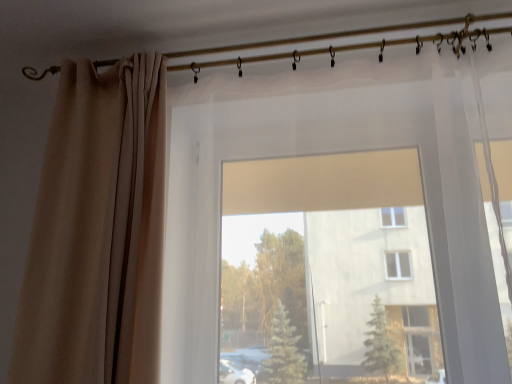
What are the coordinates of `beige fabric curtain at left` in the screenshot? It's located at (97, 232).

Describe the element at coordinates (97, 232) in the screenshot. I see `beige fabric curtain at left` at that location.

In order to face metallic curtain rod at upper center, should I rotate leftwards or rightwards?

Rotate your view left by about 0.844°.

The image size is (512, 384). I want to click on metallic curtain rod at upper center, so [x=350, y=35].

What do you see at coordinates (350, 35) in the screenshot?
I see `metallic curtain rod at upper center` at bounding box center [350, 35].

The width and height of the screenshot is (512, 384). What are the coordinates of `beige fabric curtain at left` in the screenshot? It's located at (97, 232).

Consider the image. Between beige fabric curtain at left and metallic curtain rod at upper center, which one appears on the left side from the viewer's perspective?

Positioned to the left is beige fabric curtain at left.

In the scene shown: Does beige fabric curtain at left come behind metallic curtain rod at upper center?

No, it is not.

Is point (56, 310) closer or farther from the camera than point (364, 46)?

Clearly, point (56, 310) is closer to the camera than point (364, 46).

From the image's perspective, is beige fabric curtain at left located above or below metallic curtain rod at upper center?

beige fabric curtain at left is situated lower than metallic curtain rod at upper center in the image.

From a real-world perspective, is beige fabric curtain at left positioned over metallic curtain rod at upper center based on gravity?

No, from a real-world perspective, beige fabric curtain at left is not above metallic curtain rod at upper center.

Considering the sizes of objects beige fabric curtain at left and metallic curtain rod at upper center in the image provided, who is wider, beige fabric curtain at left or metallic curtain rod at upper center?

beige fabric curtain at left.

Considering the relative sizes of beige fabric curtain at left and metallic curtain rod at upper center in the image provided, is beige fabric curtain at left shorter than metallic curtain rod at upper center?

Incorrect, the height of beige fabric curtain at left does not fall short of that of metallic curtain rod at upper center.

Between beige fabric curtain at left and metallic curtain rod at upper center, which one has larger size?

With larger size is beige fabric curtain at left.

Is beige fabric curtain at left spatially inside metallic curtain rod at upper center, or outside of it?

beige fabric curtain at left lies outside metallic curtain rod at upper center.

Would you say beige fabric curtain at left is a long distance from metallic curtain rod at upper center?

No.

Is metallic curtain rod at upper center at the back of beige fabric curtain at left?

No, beige fabric curtain at left is not facing away from metallic curtain rod at upper center.

What's the angular difference between beige fabric curtain at left and metallic curtain rod at upper center's facing directions?

There is a 4.82e-05-degree angle between the facing directions of beige fabric curtain at left and metallic curtain rod at upper center.

Find the location of a particular element. curtain on the left of metallic curtain rod at upper center is located at coordinates (97, 232).

Is metallic curtain rod at upper center at the right side of beige fabric curtain at left?

Yes, metallic curtain rod at upper center is to the right of beige fabric curtain at left.

Considering the positions of objects metallic curtain rod at upper center and beige fabric curtain at left in the image provided, who is in front, metallic curtain rod at upper center or beige fabric curtain at left?

beige fabric curtain at left.

Is point (462, 31) closer or farther from the camera than point (118, 314)?

Clearly, point (462, 31) is more distant from the camera than point (118, 314).

From the image's perspective, which one is positioned higher, metallic curtain rod at upper center or beige fabric curtain at left?

metallic curtain rod at upper center is shown above in the image.

From a real-world perspective, between metallic curtain rod at upper center and beige fabric curtain at left, who is vertically lower?

Answer: beige fabric curtain at left is physically lower.

Is metallic curtain rod at upper center wider than beige fabric curtain at left?

No.

In terms of height, does metallic curtain rod at upper center look taller or shorter compared to beige fabric curtain at left?

In the image, metallic curtain rod at upper center appears to be shorter than beige fabric curtain at left.

Between metallic curtain rod at upper center and beige fabric curtain at left, which one has smaller size?

metallic curtain rod at upper center.

Would you say metallic curtain rod at upper center is inside or outside beige fabric curtain at left?

The correct answer is: outside.

Is metallic curtain rod at upper center with beige fabric curtain at left?

metallic curtain rod at upper center is not next to beige fabric curtain at left, and they're not touching.

From the picture: Is metallic curtain rod at upper center looking in the opposite direction of beige fabric curtain at left?

No, metallic curtain rod at upper center is not facing away from beige fabric curtain at left.

In the scene shown: What's the angular difference between metallic curtain rod at upper center and beige fabric curtain at left's facing directions?

There is a 4.82e-05-degree angle between the facing directions of metallic curtain rod at upper center and beige fabric curtain at left.

Find the location of a particular element. This screenshot has height=384, width=512. curtain below the metallic curtain rod at upper center (from the image's perspective) is located at coordinates pyautogui.click(x=97, y=232).

Where is `clothesline behind the beige fabric curtain at left`? The height and width of the screenshot is (384, 512). clothesline behind the beige fabric curtain at left is located at coordinates (350, 35).

The height and width of the screenshot is (384, 512). In order to click on curtain below the metallic curtain rod at upper center (from a real-world perspective) in this screenshot , I will do `click(97, 232)`.